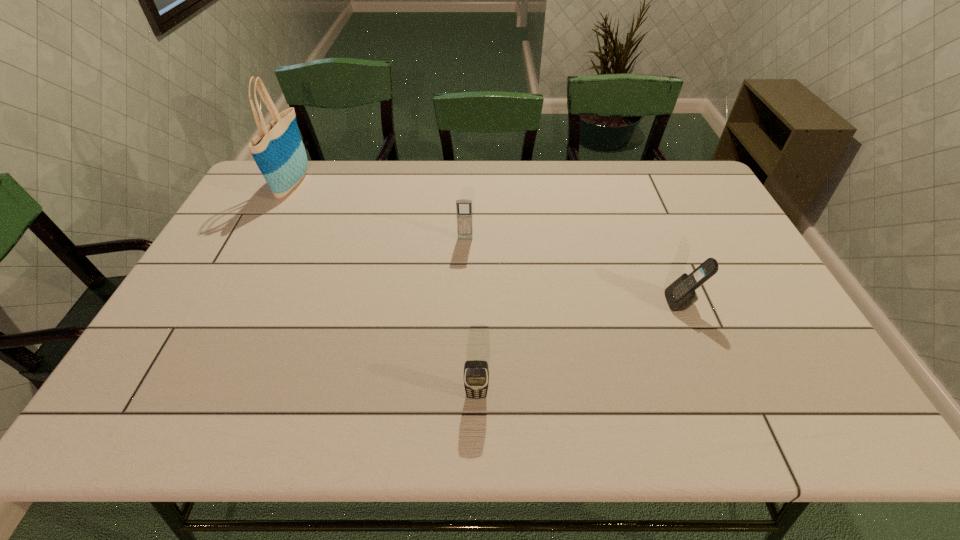
I want to click on free space between the nearest cellular telephone and the second nearest cellular telephone, so click(579, 348).

Point out which object is positioned as the third nearest to the third nearest object. Please provide its 2D coordinates. Your answer should be formatted as a tuple, i.e. [(x, y)], where the tuple contains the x and y coordinates of a point satisfying the conditions above.

[(278, 150)]

Where is `the closest object to the farthest cellular telephone`? This screenshot has height=540, width=960. the closest object to the farthest cellular telephone is located at coordinates (476, 373).

This screenshot has height=540, width=960. I want to click on cellular telephone that is the second closest to the third nearest object, so click(x=680, y=295).

Find the location of `cellular telephone object that ranks as the second closest to the third nearest object`. cellular telephone object that ranks as the second closest to the third nearest object is located at coordinates (680, 295).

This screenshot has height=540, width=960. Identify the location of free spot that satisfies the following two spatial constraints: 1. on the front-facing side of the second nearest object; 2. on the front face of the shortest cellular telephone. (721, 395).